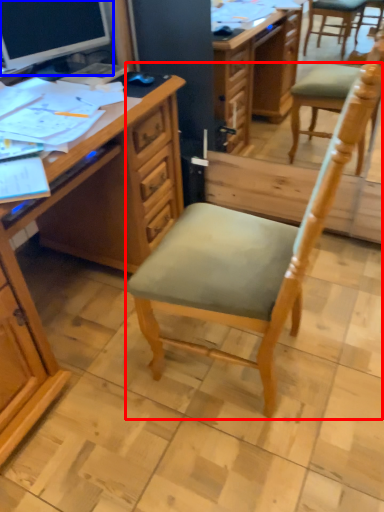
Question: Which of the following is the closest to the observer, chair (highlighted by a red box) or computer monitor (highlighted by a blue box)?

Choices:
 (A) chair
 (B) computer monitor

Answer: (A)